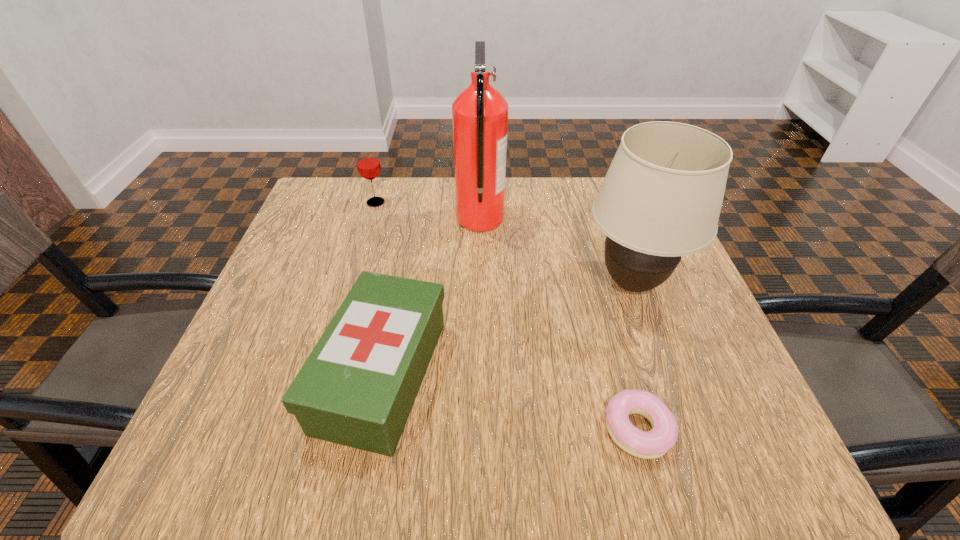
The image size is (960, 540). In order to click on object present at the far left corner in this screenshot , I will do `click(368, 164)`.

I want to click on object at the near right corner, so click(655, 443).

Where is `vacant space at the far edge`? The width and height of the screenshot is (960, 540). vacant space at the far edge is located at coordinates (580, 211).

Locate an element on the screen. The width and height of the screenshot is (960, 540). vacant space at the near edge is located at coordinates (540, 426).

The width and height of the screenshot is (960, 540). Identify the location of blank space at the left edge of the desktop. (327, 271).

The width and height of the screenshot is (960, 540). What are the coordinates of `vacant space at the right edge of the desktop` in the screenshot? It's located at (660, 386).

Locate an element on the screen. This screenshot has width=960, height=540. vacant space at the far left corner is located at coordinates click(318, 222).

Locate an element on the screen. This screenshot has height=540, width=960. empty space between the doughnut and the fire extinguisher is located at coordinates (559, 324).

The width and height of the screenshot is (960, 540). I want to click on free space between the lampshade and the glass, so (x=504, y=242).

Identify the location of vacant space that's between the glass and the second tallest object. This screenshot has height=540, width=960. (504, 242).